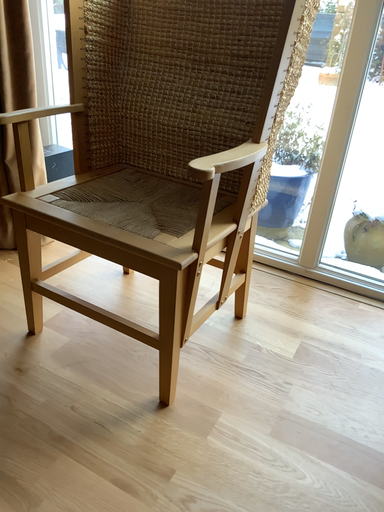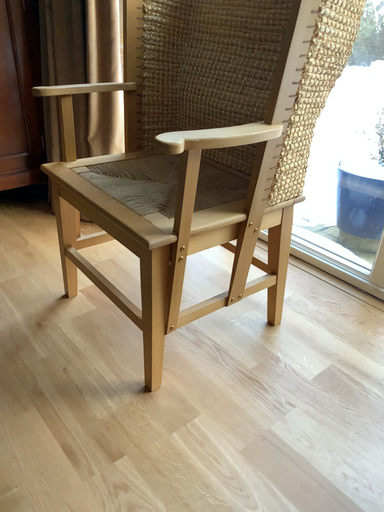
Question: Which way did the camera rotate in the video?

Choices:
 (A) rotated left
 (B) rotated right

Answer: (A)